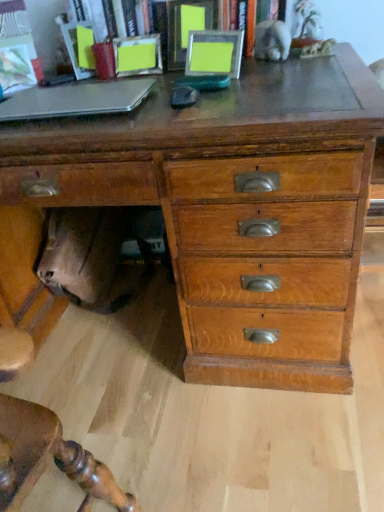
Question: Does metallic silver photo frames at upper center lie in front of silver metallic laptop at left?

Choices:
 (A) no
 (B) yes

Answer: (A)

Question: Is silver metallic laptop at left at the back of metallic silver photo frames at upper center?

Choices:
 (A) no
 (B) yes

Answer: (A)

Question: Is metallic silver photo frames at upper center far away from silver metallic laptop at left?

Choices:
 (A) yes
 (B) no

Answer: (B)

Question: Is metallic silver photo frames at upper center outside silver metallic laptop at left?

Choices:
 (A) yes
 (B) no

Answer: (A)

Question: Is metallic silver photo frames at upper center to the right of silver metallic laptop at left from the viewer's perspective?

Choices:
 (A) no
 (B) yes

Answer: (B)

Question: Is silver metallic laptop at left inside or outside of wooden chest of drawers at center?

Choices:
 (A) inside
 (B) outside

Answer: (B)

Question: Considering their positions, is silver metallic laptop at left located in front of or behind wooden chest of drawers at center?

Choices:
 (A) front
 (B) behind

Answer: (B)

Question: Is silver metallic laptop at left to the left or to the right of wooden chest of drawers at center in the image?

Choices:
 (A) left
 (B) right

Answer: (A)

Question: In terms of height, does silver metallic laptop at left look taller or shorter compared to wooden chest of drawers at center?

Choices:
 (A) short
 (B) tall

Answer: (A)

Question: From their relative heights in the image, would you say metallic silver photo frames at upper center is taller or shorter than silver metallic laptop at left?

Choices:
 (A) tall
 (B) short

Answer: (A)

Question: In terms of size, does metallic silver photo frames at upper center appear bigger or smaller than silver metallic laptop at left?

Choices:
 (A) small
 (B) big

Answer: (B)

Question: From a real-world perspective, relative to silver metallic laptop at left, is metallic silver photo frames at upper center vertically above or below?

Choices:
 (A) below
 (B) above

Answer: (B)

Question: Is metallic silver photo frames at upper center inside or outside of silver metallic laptop at left?

Choices:
 (A) inside
 (B) outside

Answer: (B)

Question: Is wooden chest of drawers at center spatially inside metallic silver photo frames at upper center, or outside of it?

Choices:
 (A) inside
 (B) outside

Answer: (B)

Question: From a real-world perspective, relative to metallic silver photo frames at upper center, is wooden chest of drawers at center vertically above or below?

Choices:
 (A) above
 (B) below

Answer: (B)